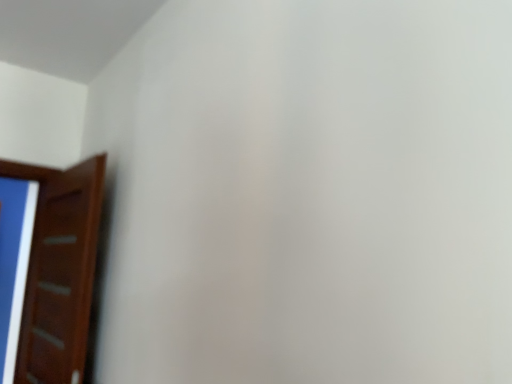
This screenshot has height=384, width=512. What do you see at coordinates (59, 270) in the screenshot? I see `brown wooden door at left` at bounding box center [59, 270].

Where is `brown wooden door at left`? brown wooden door at left is located at coordinates (59, 270).

Locate an element on the screen. brown wooden door at left is located at coordinates (59, 270).